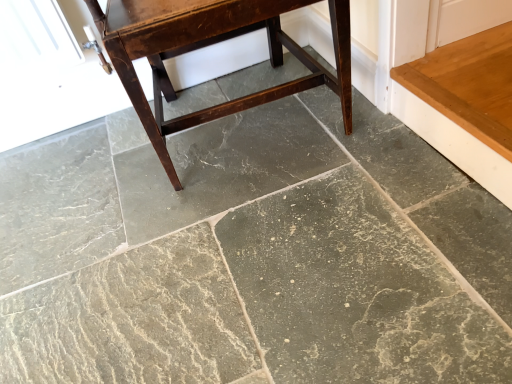
Where is `vacant space in dark brown wood table at center (from a real-world perspective)`? vacant space in dark brown wood table at center (from a real-world perspective) is located at coordinates (238, 129).